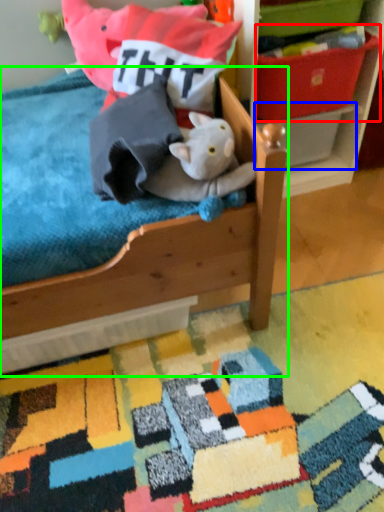
Question: Which object is positioned closest to storage box (highlighted by a red box)? Select from storage box (highlighted by a blue box) and furniture (highlighted by a green box).

Choices:
 (A) storage box
 (B) furniture

Answer: (A)